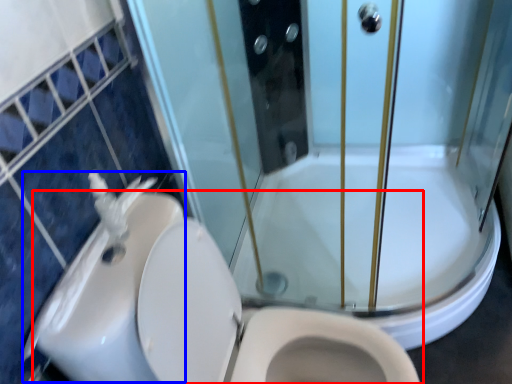
Question: Which of the following is the closest to the observer, toilet (highlighted by a red box) or sink (highlighted by a blue box)?

Choices:
 (A) toilet
 (B) sink

Answer: (A)